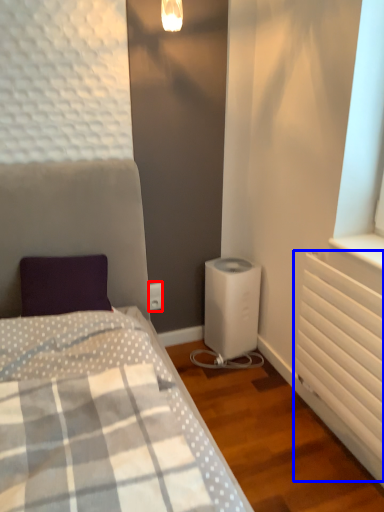
Question: Which object is further to the camera taking this photo, electric outlet (highlighted by a red box) or radiator (highlighted by a blue box)?

Choices:
 (A) electric outlet
 (B) radiator

Answer: (A)